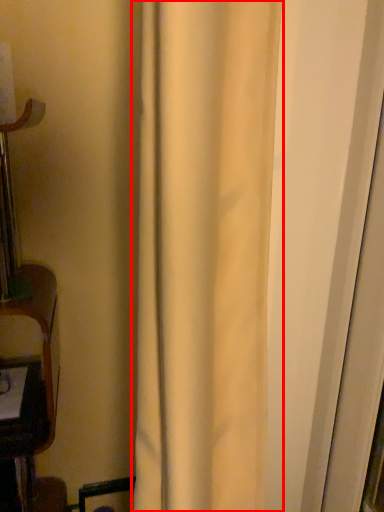
Question: From the image's perspective, what is the correct spatial relationship of curtain (annotated by the red box) in relation to screen door?

Choices:
 (A) above
 (B) below

Answer: (B)